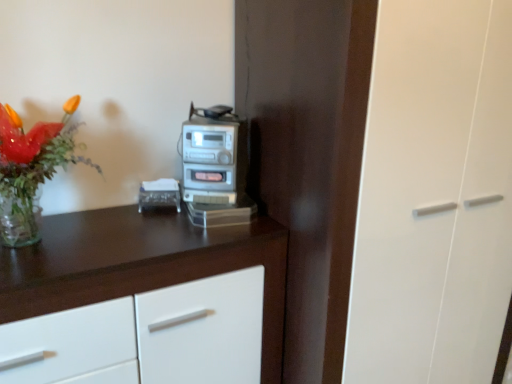
Question: Looking at their shapes, would you say translucent glass vase at upper left is wider or thinner than white glossy cabinet at upper left?

Choices:
 (A) thin
 (B) wide

Answer: (A)

Question: Considering the positions of point (65, 105) and point (276, 254), is point (65, 105) closer or farther from the camera than point (276, 254)?

Choices:
 (A) closer
 (B) farther

Answer: (B)

Question: Based on their relative distances, which object is nearer to the white glossy cabinet at upper left?

Choices:
 (A) silver metallic stereo at center
 (B) translucent glass vase at upper left
 (C) clear plastic tissue box at center
 (D) transparent glass door at center

Answer: (A)

Question: Which object is positioned farthest from the white glossy cabinet at upper left?

Choices:
 (A) clear plastic tissue box at center
 (B) translucent glass vase at upper left
 (C) transparent glass door at center
 (D) silver metallic stereo at center

Answer: (C)